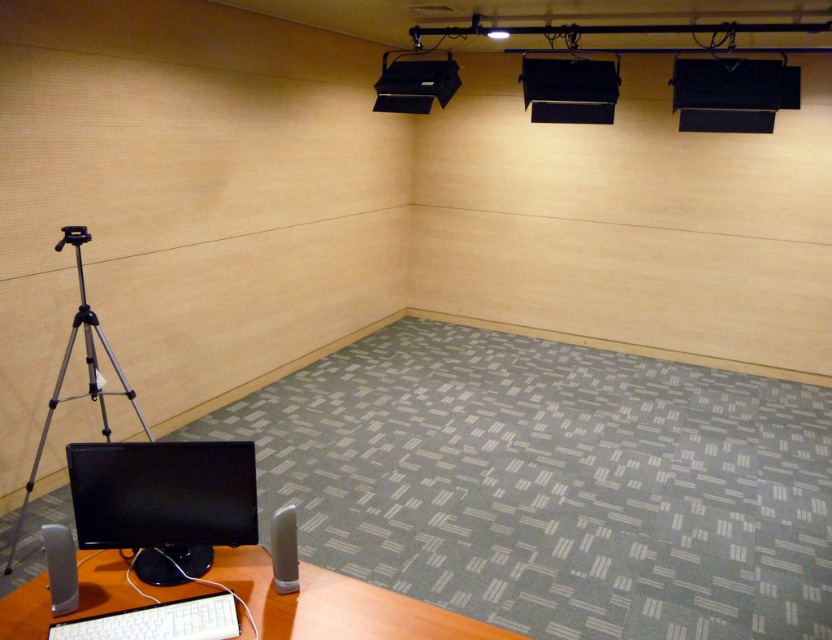
Between brown wood computer desk at lower left and white glossy speaker at lower center, which one is positioned lower?

Positioned lower is brown wood computer desk at lower left.

Can you confirm if brown wood computer desk at lower left is positioned to the right of white glossy speaker at lower center?

No, brown wood computer desk at lower left is not to the right of white glossy speaker at lower center.

Is point (268, 566) positioned before point (271, 544)?

No.

Where is `brown wood computer desk at lower left`? The height and width of the screenshot is (640, 832). brown wood computer desk at lower left is located at coordinates (335, 604).

Can you confirm if black glossy monitor at lower left is positioned below white plastic keyboard at lower center?

No, black glossy monitor at lower left is not below white plastic keyboard at lower center.

You are a GUI agent. You are given a task and a screenshot of the screen. Output one action in this format:
    pyautogui.click(x=<x>, y=<y>)
    Task: Click on the black glossy monitor at lower left
    The image size is (832, 640).
    Given the screenshot: What is the action you would take?
    pyautogui.click(x=164, y=500)

Describe the element at coordinates (164, 500) in the screenshot. This screenshot has width=832, height=640. I see `black glossy monitor at lower left` at that location.

This screenshot has width=832, height=640. Identify the location of black glossy monitor at lower left. (164, 500).

Is black glossy monitor at lower left positioned in front of gray matte speaker at lower left?

No, it is behind gray matte speaker at lower left.

Is point (102, 451) positioned before point (62, 572)?

No.

Who is more forward, (142, 522) or (73, 556)?

Point (73, 556) is in front.

The height and width of the screenshot is (640, 832). I want to click on black glossy monitor at lower left, so click(164, 500).